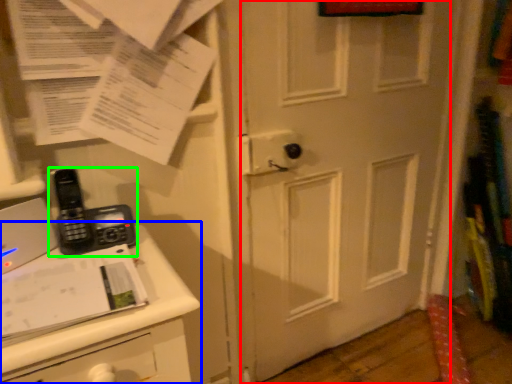
Question: Which is nearer to the door (highlighted by a red box)? changing table (highlighted by a blue box) or corded phone (highlighted by a green box).

Choices:
 (A) changing table
 (B) corded phone

Answer: (A)